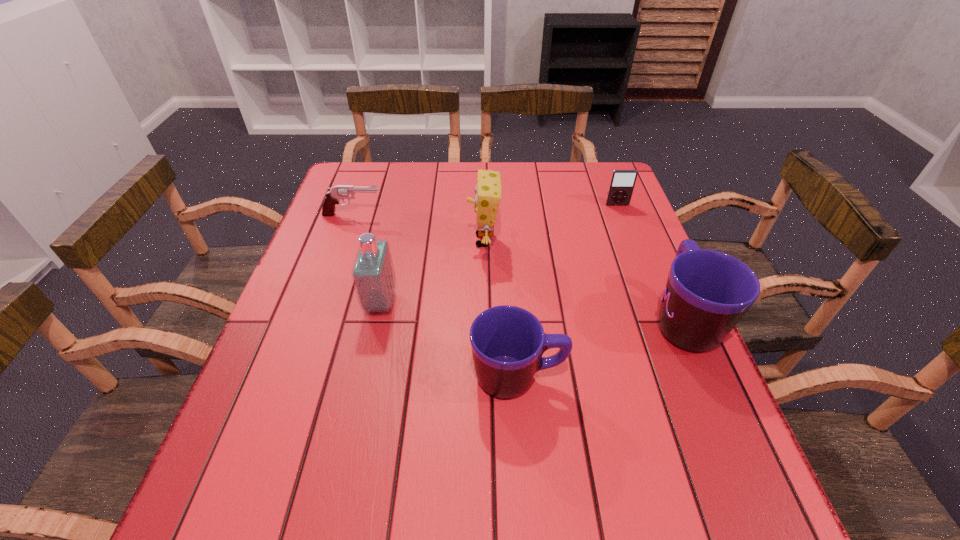
The height and width of the screenshot is (540, 960). I want to click on vacant space situated with the handle on the side of the taller mug, so click(660, 265).

Where is `vacant space located on the front-facing side of the farthest object`? vacant space located on the front-facing side of the farthest object is located at coordinates (637, 258).

You are a GUI agent. You are given a task and a screenshot of the screen. Output one action in this format:
    pyautogui.click(x=<x>, y=<y>)
    Task: Click on the vacant region located 0.110m on the face of the sponge
    
    Given the screenshot: What is the action you would take?
    pyautogui.click(x=426, y=240)

Identify the location of free region located on the face of the sponge. (426, 240).

Locate an element on the screen. The image size is (960, 540). free region located on the face of the sponge is located at coordinates (393, 240).

Locate an element on the screen. The image size is (960, 540). vacant region located 0.370m at the muzzle of the leftmost object is located at coordinates (512, 215).

In order to click on blank space located on the front label of the second object from left to right in this screenshot , I will do `click(551, 302)`.

Identify the location of object situated at the far edge. (622, 182).

You are a GUI agent. You are given a task and a screenshot of the screen. Output one action in this format:
    pyautogui.click(x=<x>, y=<y>)
    Task: Click on the object located in the left edge section of the desktop
    This screenshot has width=960, height=540.
    Given the screenshot: What is the action you would take?
    pyautogui.click(x=342, y=192)

Locate an element on the screen. The width and height of the screenshot is (960, 540). mug that is at the right edge is located at coordinates (707, 292).